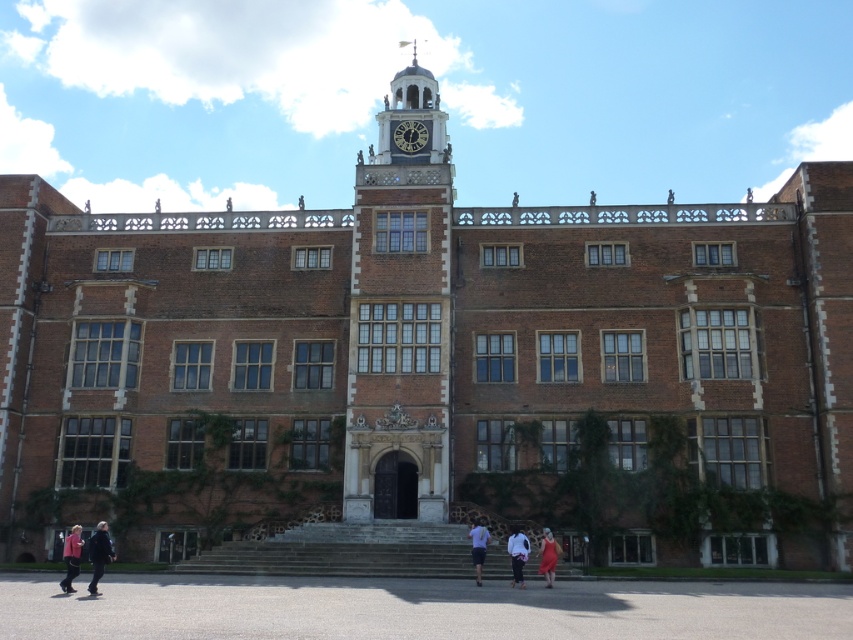
Question: Which point is farther to the camera?

Choices:
 (A) matte red dress at lower center
 (B) dark brown wooden clock at upper center

Answer: (B)

Question: Is dark blue jacket at lower left below light blue shirt at center?

Choices:
 (A) yes
 (B) no

Answer: (A)

Question: Estimate the real-world distances between objects in this image. Which object is closer to the polished brass clock tower at upper center?

Choices:
 (A) white cotton shirt at center
 (B) brick clock tower at center
 (C) light blue shirt at center

Answer: (B)

Question: Which object is farther from the camera taking this photo?

Choices:
 (A) white cotton shirt at center
 (B) light blue shirt at center
 (C) dark blue jacket at lower left
 (D) matte red dress at lower center

Answer: (D)

Question: Does polished brass clock tower at upper center appear on the right side of dark blue jacket at lower left?

Choices:
 (A) yes
 (B) no

Answer: (A)

Question: Is brick clock tower at center closer to camera compared to dark blue jacket at lower left?

Choices:
 (A) no
 (B) yes

Answer: (A)